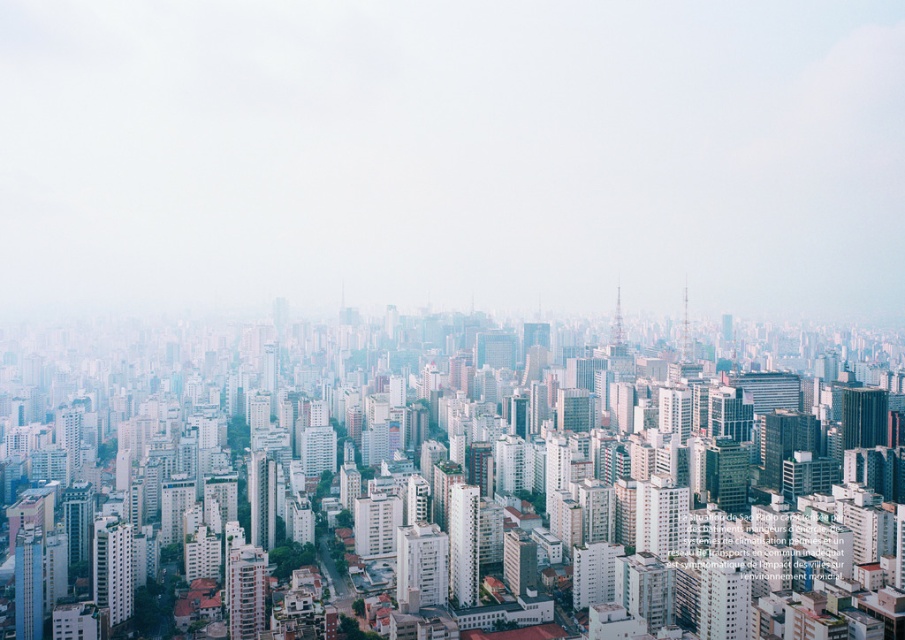
Is white glossy building at center to the right of smooth glass skyscraper at center from the viewer's perspective?

Incorrect, white glossy building at center is not on the right side of smooth glass skyscraper at center.

How distant is white glossy building at center from smooth glass skyscraper at center?

white glossy building at center and smooth glass skyscraper at center are 296.99 meters apart.

Who is more forward, [443,572] or [615,330]?

Positioned in front is point [443,572].

At what (x,y) coordinates should I click in order to perform the action: click on white glossy building at center. Please return your answer as a coordinate pair (x, y). Image resolution: width=905 pixels, height=640 pixels. Looking at the image, I should click on click(x=421, y=563).

The image size is (905, 640). I want to click on white glossy building at center, so click(x=421, y=563).

Which is in front, point (418, 595) or point (691, 344)?

Point (418, 595) is in front.

Does point (439, 536) come behind point (693, 358)?

No, it is not.

Locate an element on the screen. This screenshot has width=905, height=640. white glossy building at center is located at coordinates (421, 563).

Looking at this image, does white foggy sky at upper center have a greater width compared to white glossy building at center?

Correct, the width of white foggy sky at upper center exceeds that of white glossy building at center.

Does white foggy sky at upper center have a greater height compared to white glossy building at center?

Yes, white foggy sky at upper center is taller than white glossy building at center.

Between point (502, 16) and point (429, 548), which one is positioned behind?

The point (502, 16) is behind.

Image resolution: width=905 pixels, height=640 pixels. Find the location of `white foggy sky at upper center`. white foggy sky at upper center is located at coordinates tap(451, 156).